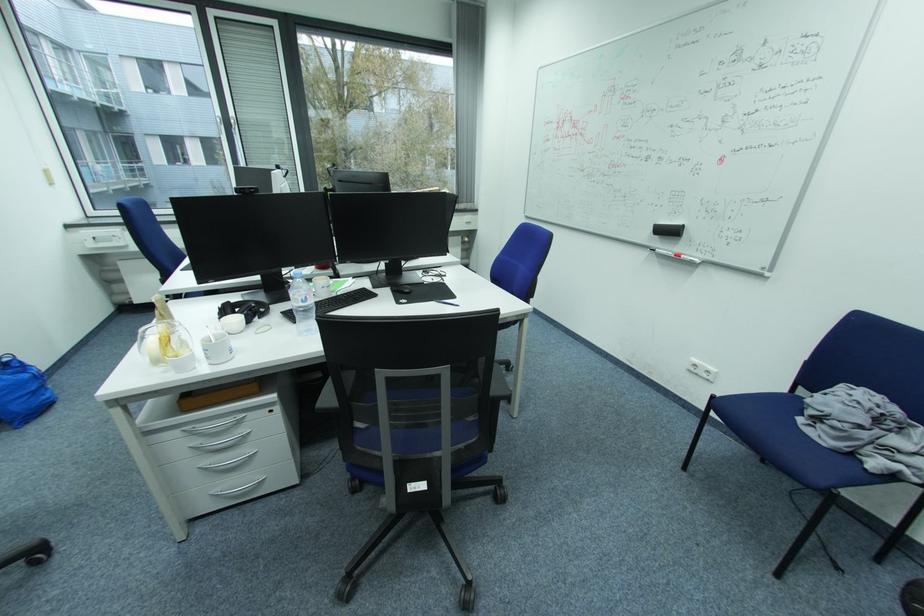
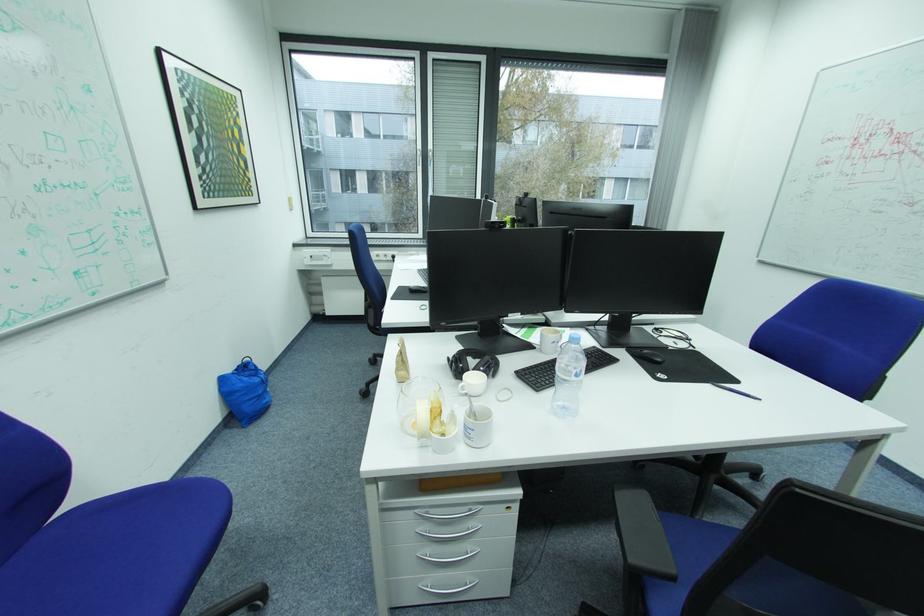
Which direction would the cameraman need to move to produce the second image?

The movement direction of the cameraman is left, forward.